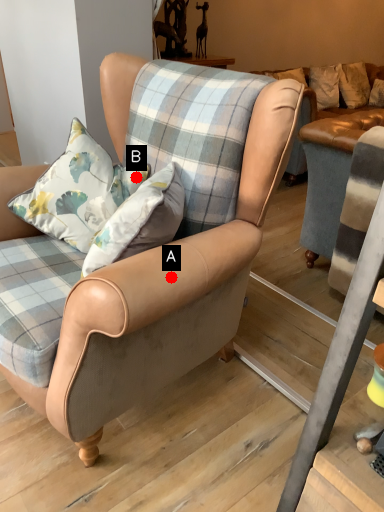
Question: Two points are circled on the image, labeled by A and B beside each circle. Which point is closer to the camera?

Choices:
 (A) A is closer
 (B) B is closer

Answer: (A)